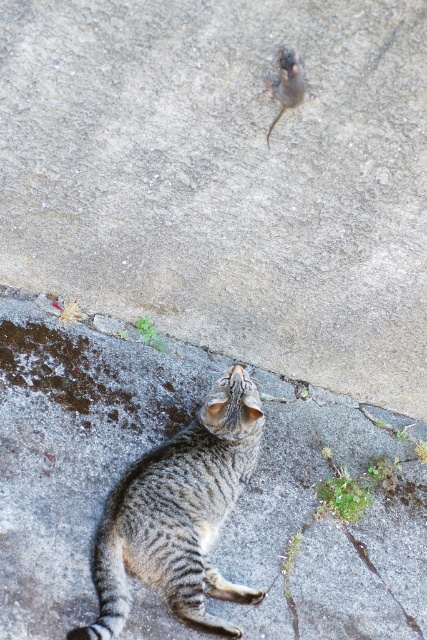
Question: Which of the following is the closest to the observer?

Choices:
 (A) (272, 536)
 (B) (145, 74)
 (C) (198, 419)

Answer: (B)

Question: Does gray striped cat at center have a larger size compared to gray stone crack at lower right?

Choices:
 (A) yes
 (B) no

Answer: (A)

Question: Is gray concrete pavement at lower center positioned behind gray stone crack at lower right?

Choices:
 (A) no
 (B) yes

Answer: (A)

Question: From the image, what is the correct spatial relationship of gray concrete at lower center in relation to gray concrete pavement at lower center?

Choices:
 (A) left
 (B) right

Answer: (B)

Question: Among these points, which one is farthest from the camera?

Choices:
 (A) (266, 499)
 (B) (145, 563)

Answer: (A)

Question: Which object is the closest to the gray striped cat at center?

Choices:
 (A) gray stone crack at lower right
 (B) gray concrete pavement at lower center
 (C) gray concrete at lower center

Answer: (B)